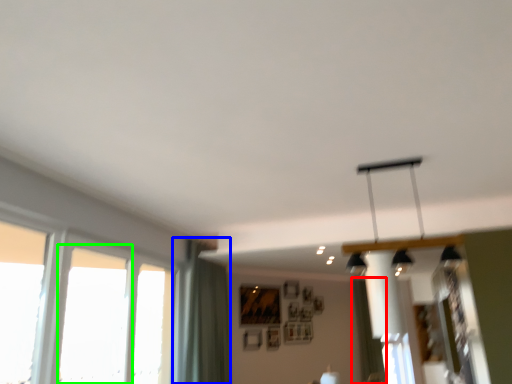
Question: Which object is positioned farthest from curtain (highlighted by a red box)? Select from curtain (highlighted by a blue box) and window (highlighted by a green box).

Choices:
 (A) curtain
 (B) window

Answer: (B)